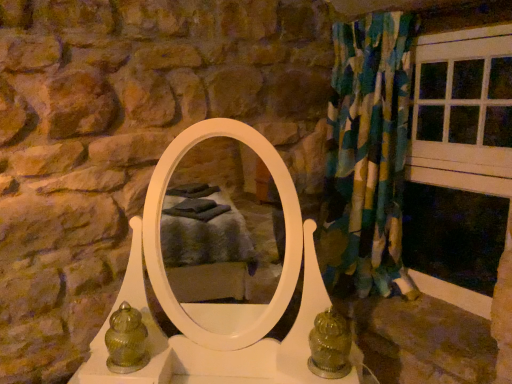
The image size is (512, 384). Find the location of `white wood window frame at right`. white wood window frame at right is located at coordinates (464, 113).

What do you see at coordinates (126, 340) in the screenshot?
I see `green glass vase at lower left` at bounding box center [126, 340].

This screenshot has width=512, height=384. In order to click on white wood window frame at right in this screenshot , I will do `click(464, 113)`.

Would you consider green glass vase at lower left to be distant from textured fabric curtain at right?

Actually, green glass vase at lower left and textured fabric curtain at right are a little close together.

Measure the distance between green glass vase at lower left and textured fabric curtain at right.

They are 39.14 inches apart.

Is point (118, 329) positioned behind point (365, 97)?

No, it is not.

Choose the correct answer: Is green glass vase at lower left inside textured fabric curtain at right or outside it?

green glass vase at lower left is located beyond the bounds of textured fabric curtain at right.

Is the position of green glass vase at lower left more distant than that of white wood window frame at right?

No, green glass vase at lower left is closer to the camera.

From a real-world perspective, which is physically above, green glass vase at lower left or white wood window frame at right?

From a 3D spatial view, white wood window frame at right is above.

Is green glass vase at lower left bigger than white wood window frame at right?

No, green glass vase at lower left is not bigger than white wood window frame at right.

Can you confirm if green glass vase at lower left is taller than white wood window frame at right?

In fact, green glass vase at lower left may be shorter than white wood window frame at right.

Would you say textured fabric curtain at right is to the left or to the right of green glass vase at lower left in the picture?

Based on their positions, textured fabric curtain at right is located to the right of green glass vase at lower left.

Is there a large distance between textured fabric curtain at right and green glass vase at lower left?

No.

Based on the photo, can you confirm if textured fabric curtain at right is taller than green glass vase at lower left?

Correct, textured fabric curtain at right is much taller as green glass vase at lower left.

In the scene shown: Is green glass vase at lower left located within textured fabric curtain at right?

No, green glass vase at lower left is located outside of textured fabric curtain at right.

Does white wood window frame at right contain textured fabric curtain at right?

No.

Which object is positioned more to the left, white wood window frame at right or textured fabric curtain at right?

textured fabric curtain at right is more to the left.

Considering the positions of points (446, 33) and (343, 179), is point (446, 33) closer to camera compared to point (343, 179)?

That is True.

From a real-world perspective, which object rests below the other?

white wood window frame at right.

How much distance is there between white wood window frame at right and green glass vase at lower left?

white wood window frame at right is 4.18 feet away from green glass vase at lower left.

Considering the sizes of white wood window frame at right and green glass vase at lower left in the image, is white wood window frame at right taller or shorter than green glass vase at lower left?

In the image, white wood window frame at right appears to be taller than green glass vase at lower left.

Is green glass vase at lower left located within white wood window frame at right?

Actually, green glass vase at lower left is outside white wood window frame at right.

Looking at this image, is white wood window frame at right facing away from green glass vase at lower left?

That's not correct — white wood window frame at right is not looking away from green glass vase at lower left.

Considering the sizes of objects textured fabric curtain at right and white wood window frame at right in the image provided, who is shorter, textured fabric curtain at right or white wood window frame at right?

With less height is white wood window frame at right.

Is textured fabric curtain at right positioned far away from white wood window frame at right?

No, textured fabric curtain at right is not far away from white wood window frame at right.

Considering the relative sizes of textured fabric curtain at right and white wood window frame at right in the image provided, is textured fabric curtain at right bigger than white wood window frame at right?

Yes, textured fabric curtain at right is bigger than white wood window frame at right.

This screenshot has width=512, height=384. I want to click on curtain located above the green glass vase at lower left (from the image's perspective), so click(367, 156).

Image resolution: width=512 pixels, height=384 pixels. I want to click on window frame to the right of green glass vase at lower left, so click(x=464, y=113).

Based on their spatial positions, is green glass vase at lower left or white wood window frame at right further from textured fabric curtain at right?

green glass vase at lower left.

Considering their positions, is textured fabric curtain at right positioned closer to green glass vase at lower left than white wood window frame at right?

textured fabric curtain at right is positioned closer to the anchor green glass vase at lower left.

Based on their spatial positions, is green glass vase at lower left or textured fabric curtain at right closer to white wood window frame at right?

Among the two, textured fabric curtain at right is located nearer to white wood window frame at right.

Looking at this image, which object lies nearer to the anchor point green glass vase at lower left, white wood window frame at right or textured fabric curtain at right?

textured fabric curtain at right.

Estimate the real-world distances between objects in this image. Which object is closer to textured fabric curtain at right, white wood window frame at right or green glass vase at lower left?

white wood window frame at right lies closer to textured fabric curtain at right than the other object.

Looking at the image, which one is located further to white wood window frame at right, textured fabric curtain at right or green glass vase at lower left?

green glass vase at lower left.

What are the coordinates of `curtain situated between green glass vase at lower left and white wood window frame at right from left to right` in the screenshot? It's located at (367, 156).